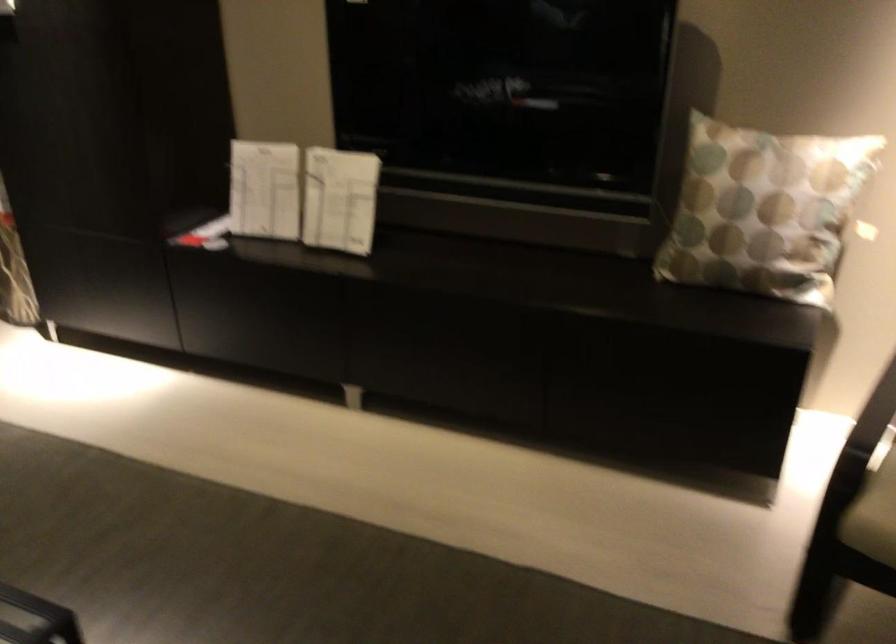
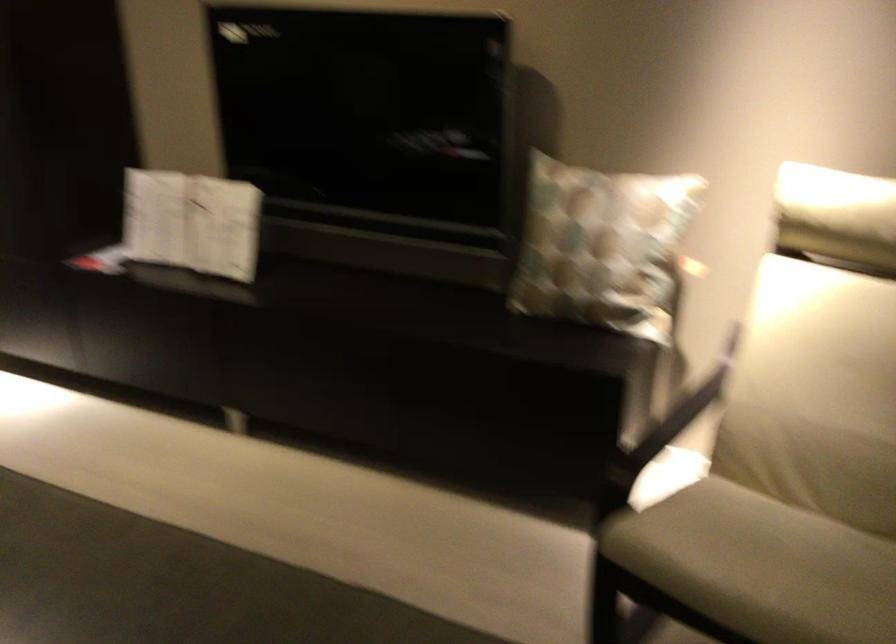
Locate, in the second image, the point that corresponds to [306,193] in the first image.

(192, 222)